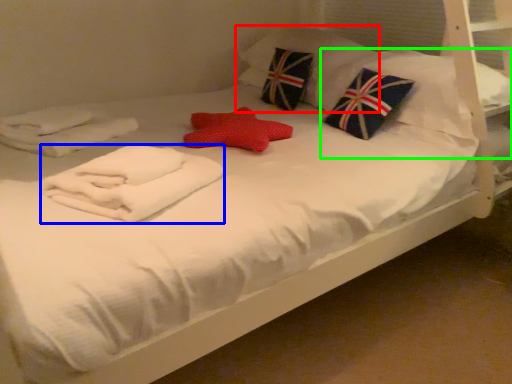
Question: Considering the real-world distances, which object is closest to pillow (highlighted by a red box)? material (highlighted by a blue box) or pillow (highlighted by a green box).

Choices:
 (A) material
 (B) pillow

Answer: (B)